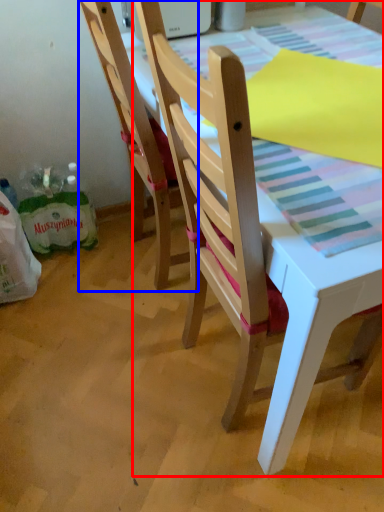
Question: Which point is closer to the camera, chair (highlighted by a red box) or chair (highlighted by a blue box)?

Choices:
 (A) chair
 (B) chair

Answer: (A)